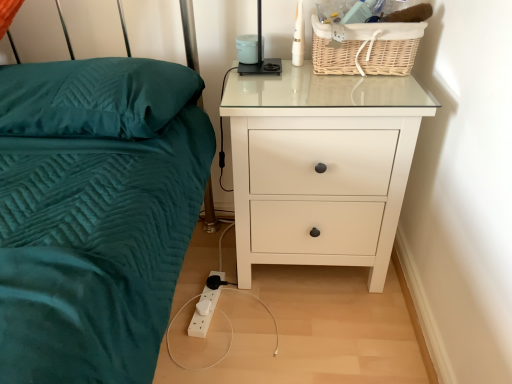
This screenshot has height=384, width=512. Describe the element at coordinates (260, 56) in the screenshot. I see `black plastic lamp at upper center` at that location.

The image size is (512, 384). Describe the element at coordinates (323, 162) in the screenshot. I see `white glossy chest of drawers at right` at that location.

This screenshot has height=384, width=512. In order to click on black plastic lamp at upper center in this screenshot , I will do `click(260, 56)`.

Can you tell me how much white glossy chest of drawers at right and black plastic lamp at upper center differ in facing direction?

The angle between the facing direction of white glossy chest of drawers at right and the facing direction of black plastic lamp at upper center is 8.99e-05 degrees.

Considering the positions of point (277, 255) and point (260, 29), is point (277, 255) closer or farther from the camera than point (260, 29)?

Point (277, 255).

Is white glossy chest of drawers at right at the left side of black plastic lamp at upper center?

In fact, white glossy chest of drawers at right is to the right of black plastic lamp at upper center.

Is white glossy chest of drawers at right located outside black plastic lamp at upper center?

Absolutely, white glossy chest of drawers at right is external to black plastic lamp at upper center.

Is teal quilted pillow at left far away from black plastic lamp at upper center?

They are positioned close to each other.

Between teal quilted pillow at left and black plastic lamp at upper center, which one has more height?

Standing taller between the two is black plastic lamp at upper center.

Does teal quilted pillow at left appear on the left side of black plastic lamp at upper center?

Yes, teal quilted pillow at left is to the left of black plastic lamp at upper center.

Is teal quilted pillow at left completely or partially outside of black plastic lamp at upper center?

That's correct, teal quilted pillow at left is outside of black plastic lamp at upper center.

Is black plastic lamp at upper center looking in the opposite direction of teal quilted pillow at left?

black plastic lamp at upper center does not have its back to teal quilted pillow at left.

Between black plastic lamp at upper center and teal quilted pillow at left, which one has less height?

With less height is teal quilted pillow at left.

Is black plastic lamp at upper center not within teal quilted pillow at left?

That's correct, black plastic lamp at upper center is outside of teal quilted pillow at left.

From the picture: Is black plastic lamp at upper center to the right of teal quilted pillow at left from the viewer's perspective?

Indeed, black plastic lamp at upper center is positioned on the right side of teal quilted pillow at left.

Can you confirm if teal quilted pillow at left is smaller than woven natural basket at upper right?

Incorrect, teal quilted pillow at left is not smaller in size than woven natural basket at upper right.

Is teal quilted pillow at left to the right of woven natural basket at upper right from the viewer's perspective?

No, teal quilted pillow at left is not to the right of woven natural basket at upper right.

Is teal quilted pillow at left taller or shorter than woven natural basket at upper right?

Clearly, teal quilted pillow at left is shorter compared to woven natural basket at upper right.

Is woven natural basket at upper right oriented away from black plastic lamp at upper center?

No, woven natural basket at upper right is not facing the opposite direction of black plastic lamp at upper center.

Which of these two, woven natural basket at upper right or black plastic lamp at upper center, is thinner?

black plastic lamp at upper center is thinner.

Can you confirm if woven natural basket at upper right is smaller than black plastic lamp at upper center?

No.

Does point (403, 69) come closer to viewer compared to point (255, 72)?

Yes, it is in front of point (255, 72).

From the picture: Is teal quilted pillow at left facing away from white glossy chest of drawers at right?

teal quilted pillow at left does not have its back to white glossy chest of drawers at right.

Considering the sizes of objects teal quilted pillow at left and white glossy chest of drawers at right in the image provided, who is smaller, teal quilted pillow at left or white glossy chest of drawers at right?

teal quilted pillow at left.

Is the position of teal quilted pillow at left less distant than that of white glossy chest of drawers at right?

Yes, teal quilted pillow at left is closer to the camera.

Can you tell me how much black plastic lamp at upper center and woven natural basket at upper right differ in facing direction?

4.89e-05 degrees.

Based on the photo, in the image, is black plastic lamp at upper center on the left side or the right side of woven natural basket at upper right?

black plastic lamp at upper center is to the left of woven natural basket at upper right.

Is the surface of black plastic lamp at upper center in direct contact with woven natural basket at upper right?

No, black plastic lamp at upper center is not in contact with woven natural basket at upper right.

Considering the sizes of objects black plastic lamp at upper center and woven natural basket at upper right in the image provided, who is smaller, black plastic lamp at upper center or woven natural basket at upper right?

Smaller between the two is black plastic lamp at upper center.

The image size is (512, 384). I want to click on bedside lamp above the white glossy chest of drawers at right (from a real-world perspective), so pyautogui.click(x=260, y=56).

The height and width of the screenshot is (384, 512). In order to click on bedside lamp above the teal quilted pillow at left (from the image's perspective) in this screenshot , I will do `click(260, 56)`.

Looking at this image, estimate the real-world distances between objects in this image. Which object is closer to teal quilted pillow at left, black plastic lamp at upper center or woven natural basket at upper right?

black plastic lamp at upper center is positioned closer to the anchor teal quilted pillow at left.

Based on their spatial positions, is teal quilted pillow at left or black plastic lamp at upper center closer to woven natural basket at upper right?

Based on the image, black plastic lamp at upper center appears to be nearer to woven natural basket at upper right.

From the image, which object appears to be farther from teal quilted pillow at left, white glossy chest of drawers at right or black plastic lamp at upper center?

The object further to teal quilted pillow at left is black plastic lamp at upper center.

When comparing their distances from woven natural basket at upper right, does black plastic lamp at upper center or white glossy chest of drawers at right seem further?

white glossy chest of drawers at right is further to woven natural basket at upper right.

Considering their positions, is woven natural basket at upper right positioned closer to white glossy chest of drawers at right than teal quilted pillow at left?

Among the two, woven natural basket at upper right is located nearer to white glossy chest of drawers at right.

Consider the image. From the image, which object appears to be nearer to white glossy chest of drawers at right, woven natural basket at upper right or black plastic lamp at upper center?

woven natural basket at upper right lies closer to white glossy chest of drawers at right than the other object.

Looking at the image, which one is located closer to woven natural basket at upper right, white glossy chest of drawers at right or black plastic lamp at upper center?

black plastic lamp at upper center lies closer to woven natural basket at upper right than the other object.

Based on their spatial positions, is white glossy chest of drawers at right or teal quilted pillow at left further from black plastic lamp at upper center?

The object further to black plastic lamp at upper center is teal quilted pillow at left.

Locate an element on the screen. bedside lamp between teal quilted pillow at left and white glossy chest of drawers at right from left to right is located at coordinates (260, 56).

The image size is (512, 384). What are the coordinates of `bedside lamp between woven natural basket at upper right and white glossy chest of drawers at right from top to bottom` in the screenshot? It's located at (260, 56).

Where is `bedside lamp between teal quilted pillow at left and woven natural basket at upper right from left to right`? This screenshot has height=384, width=512. bedside lamp between teal quilted pillow at left and woven natural basket at upper right from left to right is located at coordinates (260, 56).

Identify the location of the chest of drawers situated between teal quilted pillow at left and woven natural basket at upper right from left to right. This screenshot has width=512, height=384. (323, 162).